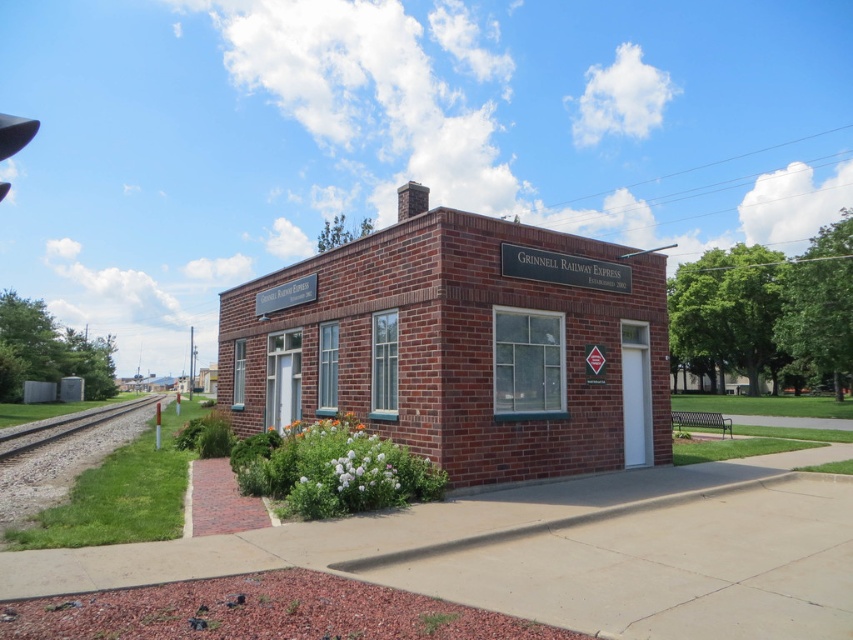
You are standing at the entrance of the brick building and want to find the point marked at coordinates (461,346). According to the image, where should you look?

The point marked at coordinates (461,346) is located on the brick building at center, so you should look at the brick building in the center of the image to find that point.

You are a delivery person trying to park your 2.5 meter wide truck between the brick building at center and the gray gravel train track at lower left. Based on the scene, can your truck fit in that space?

The brick building at center is thinner than the gray gravel train track at lower left, so the space between them is wider than 2.5 meters. Your truck can fit between the brick building at center and the gray gravel train track at lower left.

You are a visitor approaching the Grinnell Railway Express building. You see the brick building at center and the gray gravel train track at lower left. Which object is closer to your current position as you walk towards the entrance?

The gray gravel train track at lower left is closer to your current position because the brick building at center is to the right of it, meaning the track is in front of the building along your path.